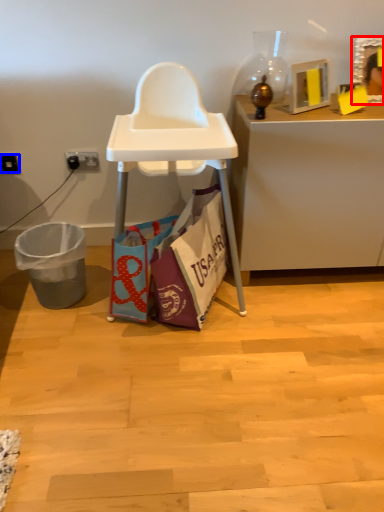
Question: Which object appears farthest to the camera in this image, picture frame (highlighted by a red box) or power outlet (highlighted by a blue box)?

Choices:
 (A) picture frame
 (B) power outlet

Answer: (B)